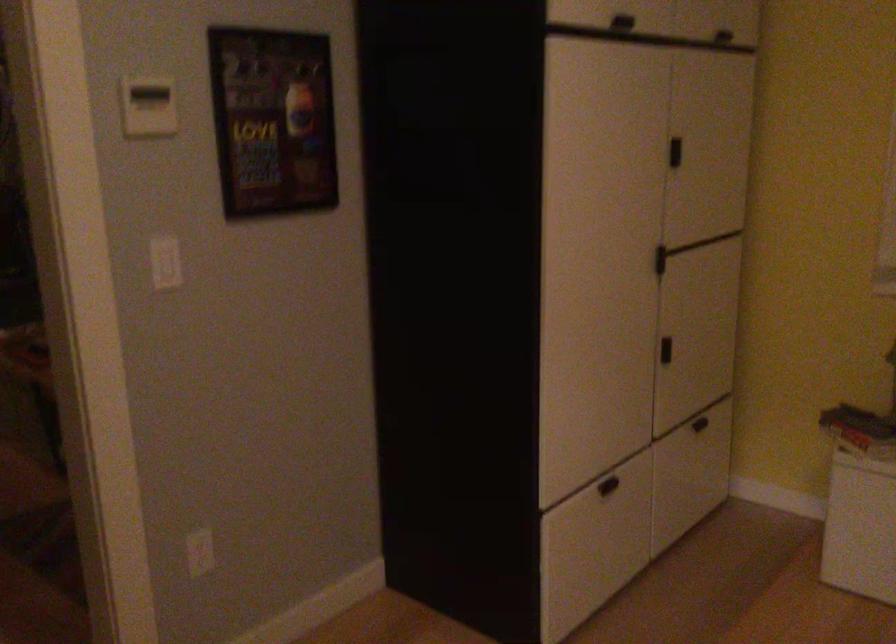
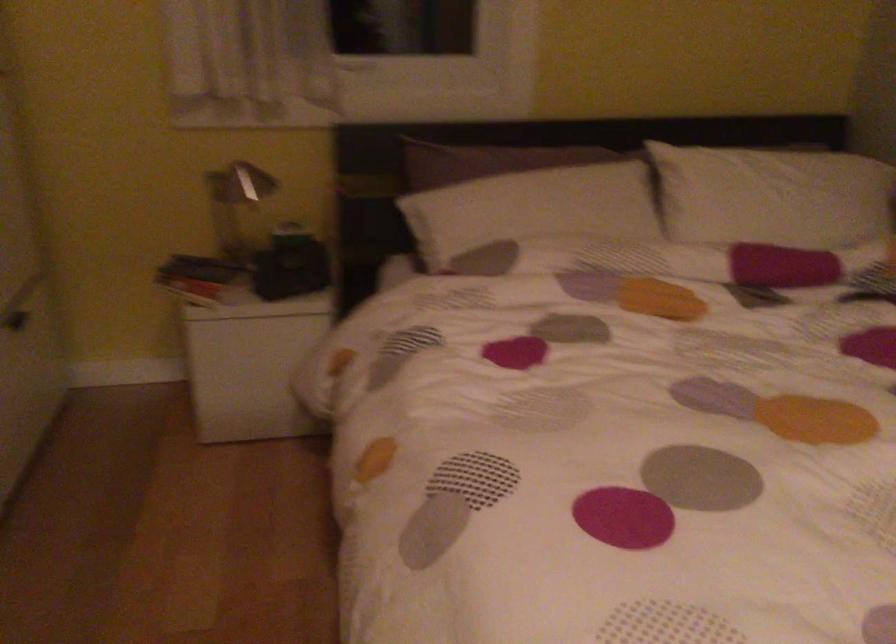
Question: The camera is either moving clockwise (left) or counter-clockwise (right) around the object. The first image is from the beginning of the video and the second image is from the end. Is the camera moving left or right when shooting the video?

Choices:
 (A) Left
 (B) Right

Answer: (A)